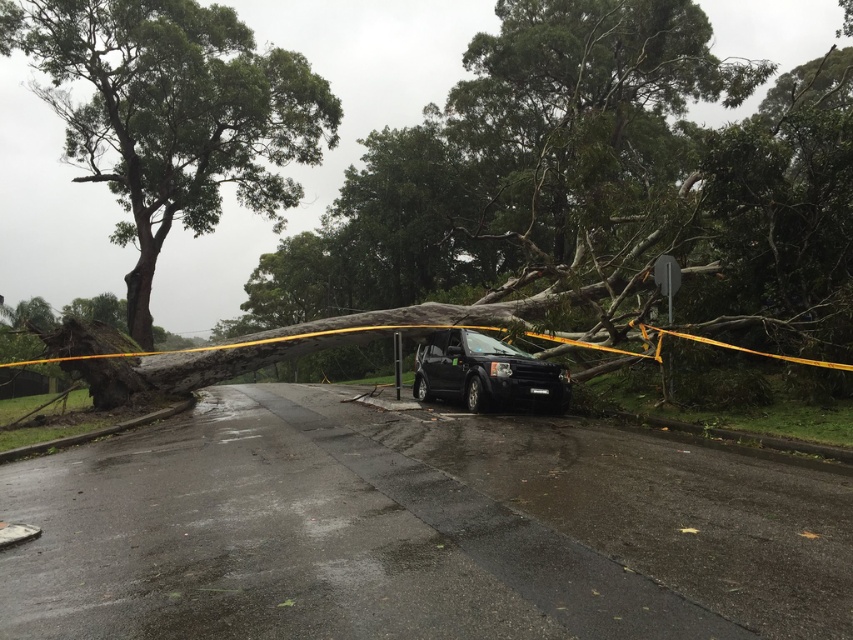
Between dark gray bark tree at center and green rough bark tree at upper left, which one appears on the right side from the viewer's perspective?

dark gray bark tree at center is more to the right.

Locate an element on the screen. The height and width of the screenshot is (640, 853). dark gray bark tree at center is located at coordinates (595, 188).

Where is `dark gray bark tree at center`? Image resolution: width=853 pixels, height=640 pixels. dark gray bark tree at center is located at coordinates (595, 188).

Can you confirm if green rough bark tree at upper left is positioned below black matte suv at center?

No.

In the scene shown: Does green rough bark tree at upper left appear over black matte suv at center?

Yes, green rough bark tree at upper left is above black matte suv at center.

Who is more forward, (134,216) or (488,336)?

Point (488,336)

Where is `green rough bark tree at upper left`? The width and height of the screenshot is (853, 640). green rough bark tree at upper left is located at coordinates (171, 115).

Is dark gray bark tree at center wider than black matte suv at center?

Yes.

Can you confirm if dark gray bark tree at center is taller than black matte suv at center?

Correct, dark gray bark tree at center is much taller as black matte suv at center.

Is point (576, 168) in front of point (457, 333)?

No, (576, 168) is further to viewer.

Locate an element on the screen. Image resolution: width=853 pixels, height=640 pixels. dark gray bark tree at center is located at coordinates (595, 188).